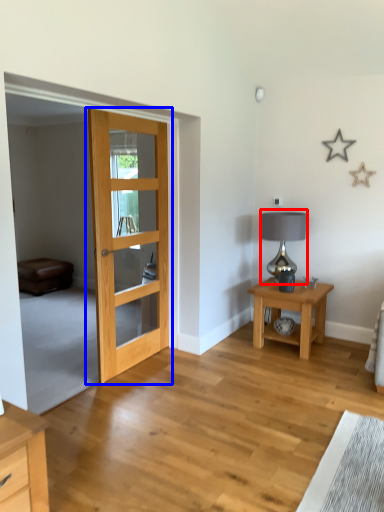
Question: Which of the following is the closest to the observer, table lamp (highlighted by a red box) or door (highlighted by a blue box)?

Choices:
 (A) table lamp
 (B) door

Answer: (B)